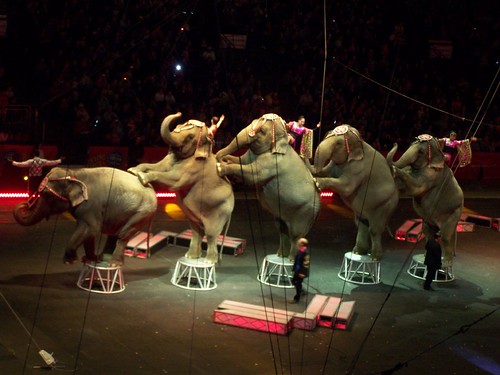
Find the location of a particular element. five white stands is located at coordinates (422, 270), (362, 276), (281, 274), (203, 275), (111, 286).